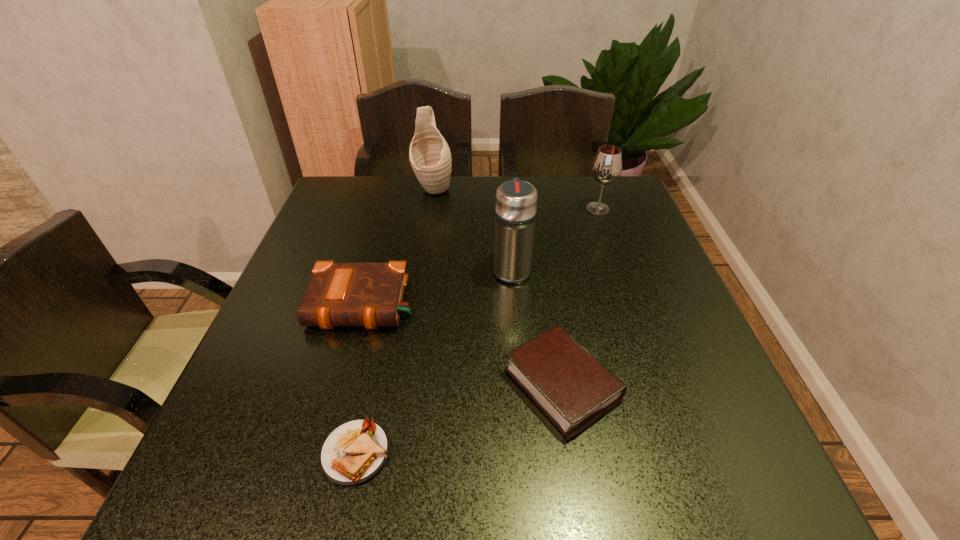
Identify the location of the farthest object. (430, 157).

The image size is (960, 540). I want to click on thermos bottle, so click(516, 200).

This screenshot has height=540, width=960. In order to click on the rightmost object in this screenshot , I will do `click(606, 167)`.

Identify the location of wineglass. Image resolution: width=960 pixels, height=540 pixels. click(606, 167).

Where is `the left Bible`? This screenshot has height=540, width=960. the left Bible is located at coordinates (339, 294).

The height and width of the screenshot is (540, 960). What are the coordinates of `the farther Bible` in the screenshot? It's located at (339, 294).

Identify the location of the shorter Bible. (573, 389).

I want to click on the right Bible, so click(573, 389).

The height and width of the screenshot is (540, 960). I want to click on sandwich, so click(355, 451).

I want to click on free space located at the spout of the farthest object, so click(x=427, y=231).